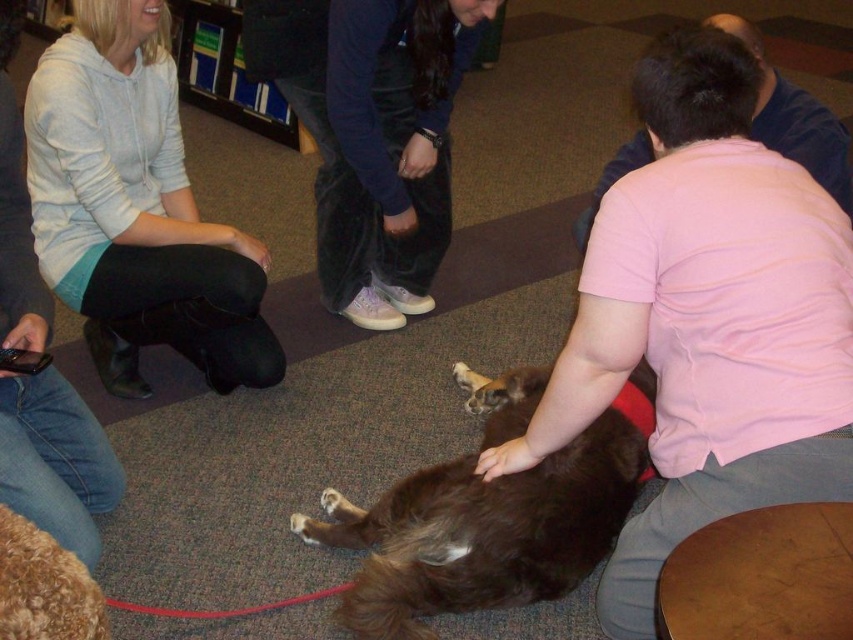
You are a photographer trying to capture a closeup of the brown furry dog at center. You have a camera that can focus on subjects within 15 inches. Is the pink cotton shirt at lower right too close to the dog for the camera to focus properly?

The pink cotton shirt at lower right is 14.70 inches from the brown furry dog at center, so it is within the camera focus range of 15 inches. The camera should be able to focus on the dog without the shirt being too close to interfere.

You are a photographer trying to capture a photo of the curly golden fur dog at lower left without the light blue hoodie at upper left blocking the view. Is the dog currently visible from your position?

The curly golden fur dog at lower left is behind the light blue hoodie at upper left, so it is currently blocked from view by the hoodie.